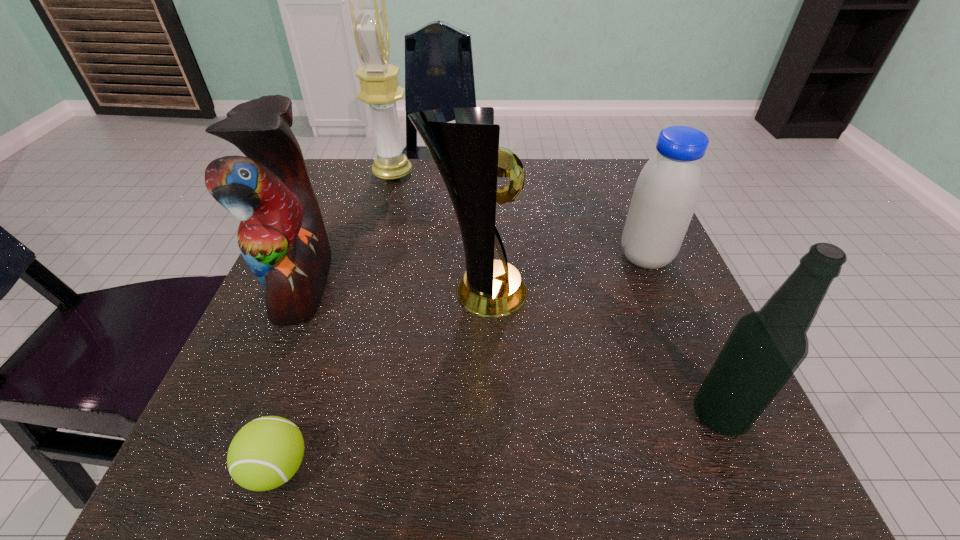
Image resolution: width=960 pixels, height=540 pixels. Identify the location of the left award. (380, 89).

Identify the location of the farthest object. The width and height of the screenshot is (960, 540). (380, 89).

Find the location of a particular element. the nearer award is located at coordinates (467, 155).

The width and height of the screenshot is (960, 540). I want to click on the third object from right to left, so click(467, 155).

Locate an element on the screen. This screenshot has height=540, width=960. parrot is located at coordinates (282, 238).

The height and width of the screenshot is (540, 960). What are the coordinates of `alcohol` in the screenshot? It's located at (766, 347).

Where is `soya milk`? soya milk is located at coordinates [667, 191].

Where is `the shortest object`? This screenshot has width=960, height=540. the shortest object is located at coordinates (265, 453).

At what (x,y) coordinates should I click in order to perform the action: click on vacant position located on the front-facing side of the farthest object. Please return your answer as a coordinate pair (x, y). Looking at the image, I should click on (532, 174).

This screenshot has height=540, width=960. Identify the location of vacant space located 0.110m at the front of the third object from right to left, where the globe is visible. (590, 292).